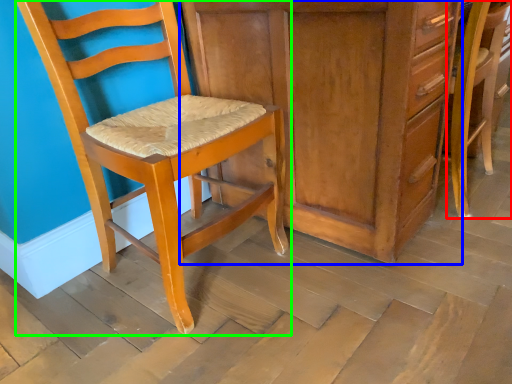
Question: Which object is positioned closest to chair (highlighted by a red box)? Select from cabinetry (highlighted by a blue box) and chair (highlighted by a green box).

Choices:
 (A) cabinetry
 (B) chair

Answer: (A)